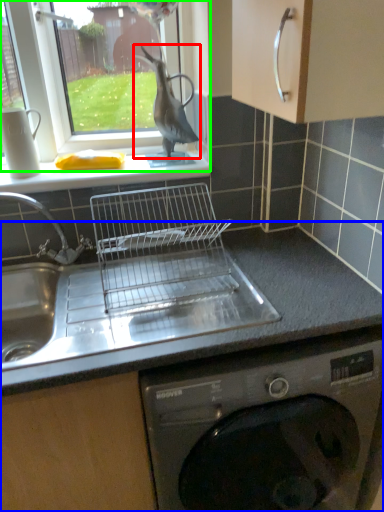
Question: Estimate the real-world distances between objects in this image. Which object is closer to animal (highlighted by a red box), countertop (highlighted by a blue box) or window (highlighted by a green box)?

Choices:
 (A) countertop
 (B) window

Answer: (B)